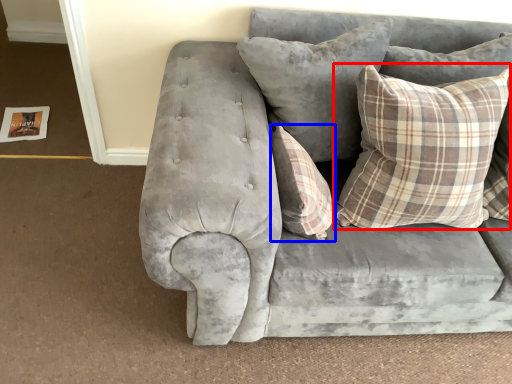
Question: Which object is closer to the camera taking this photo, pillow (highlighted by a red box) or pillow (highlighted by a blue box)?

Choices:
 (A) pillow
 (B) pillow

Answer: (A)